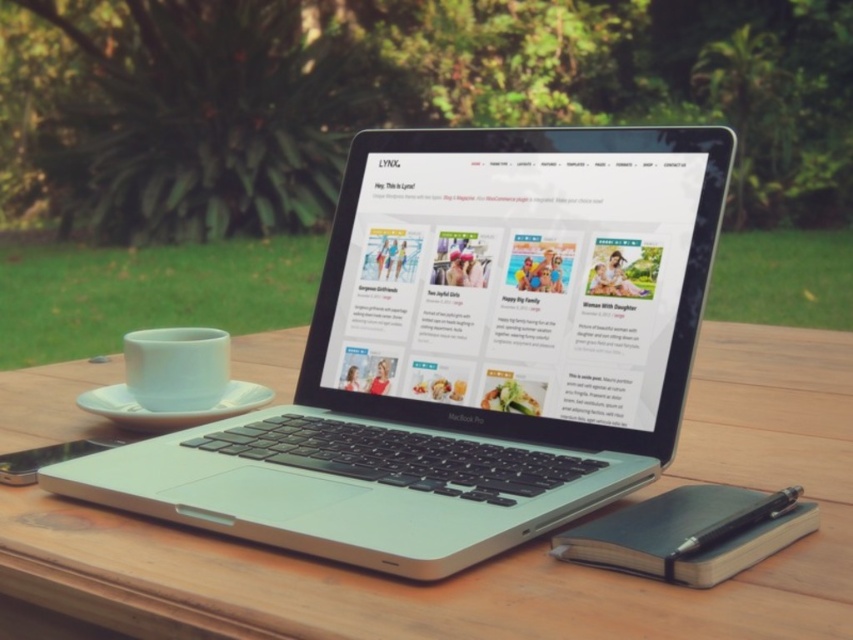
You are standing at the edge of the wooden table at center. A point is marked at coordinate (500,556). Is this point on the table?

Yes, the point at (500,556) is on the wooden table at center.

You are standing in front of the wooden table and see two points marked on the table surface. The first point is at coordinate point [531,284] and the second point is at coordinate point [252,564]. Which point is closer to you?

Point [531,284] is further to the viewer than point [252,564], so the second point at [252,564] is closer to you.

You have a new tablet that is 12 inches wide. You want to place it on the wooden table at center where the sleek silver laptop at center is currently placed. Will the tablet fit on the table without overlapping the edges?

The sleek silver laptop at center is less than the width of the wooden table at center. Since the tablet is 12 inches wide, it might fit, but we need to know the exact width of the table to confirm. However, since the laptop is already placed there and the table is wider, there is a possibility it could fit depending on the available space.